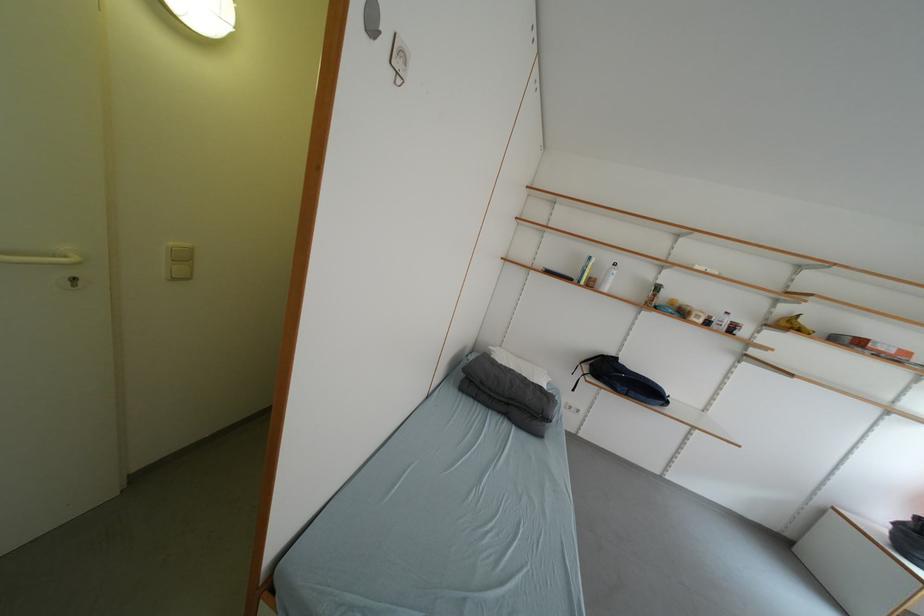
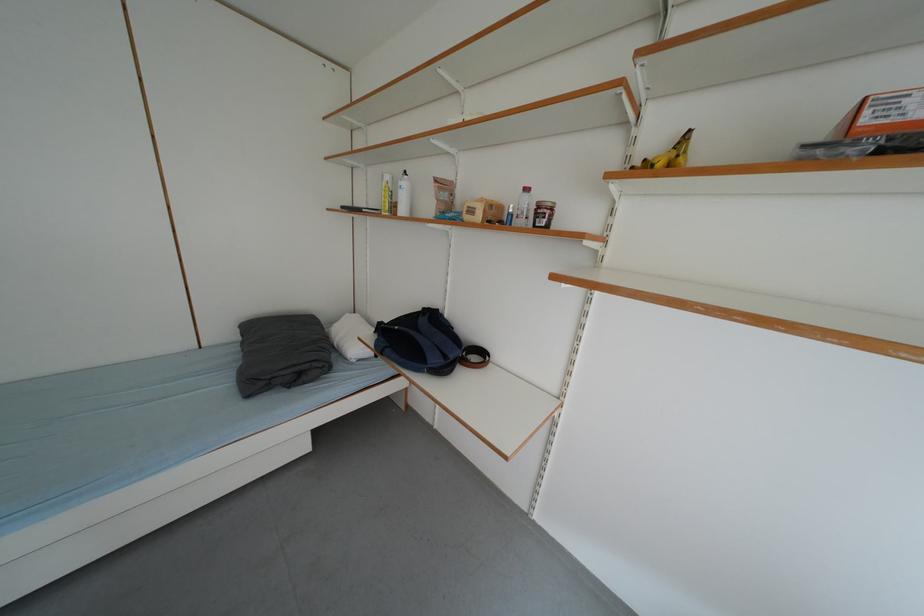
Locate, in the second image, the point that corresponds to point (709, 323) in the first image.

(487, 220)